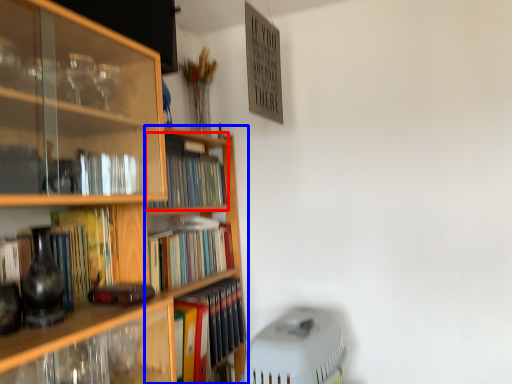
Question: Among these objects, which one is farthest to the camera, book (highlighted by a red box) or bookshelf (highlighted by a blue box)?

Choices:
 (A) book
 (B) bookshelf

Answer: (A)